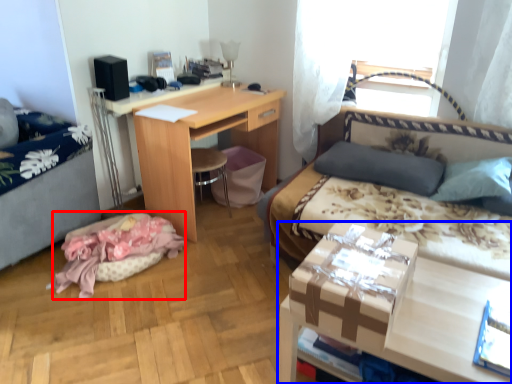
Question: Which object appears closest to the camera in this image, material (highlighted by a red box) or desk (highlighted by a blue box)?

Choices:
 (A) material
 (B) desk

Answer: (B)